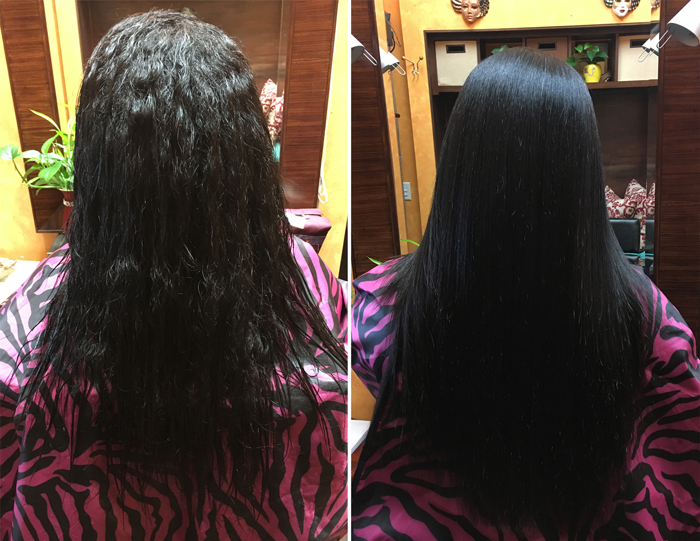
The image size is (700, 541). Find the location of `plant`. plant is located at coordinates (69, 151).